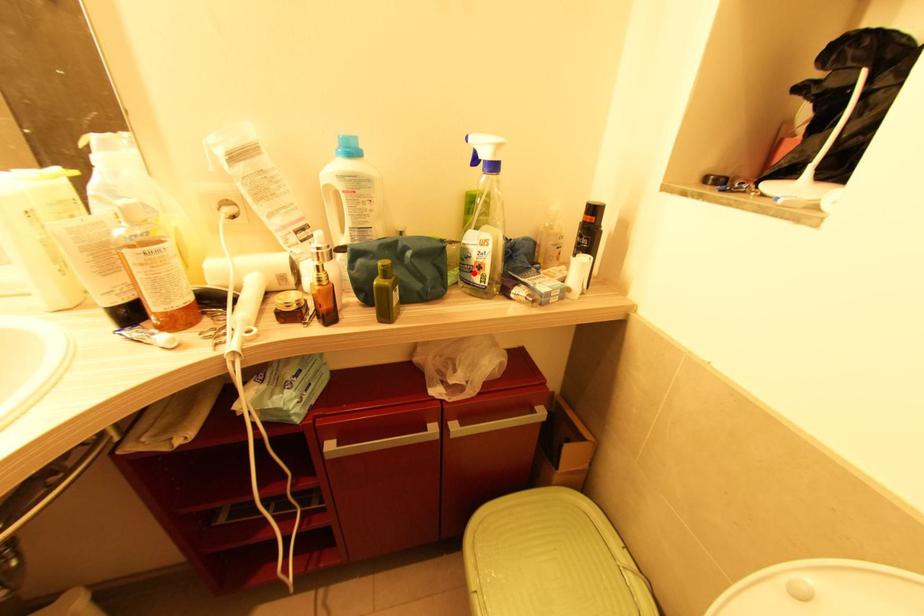
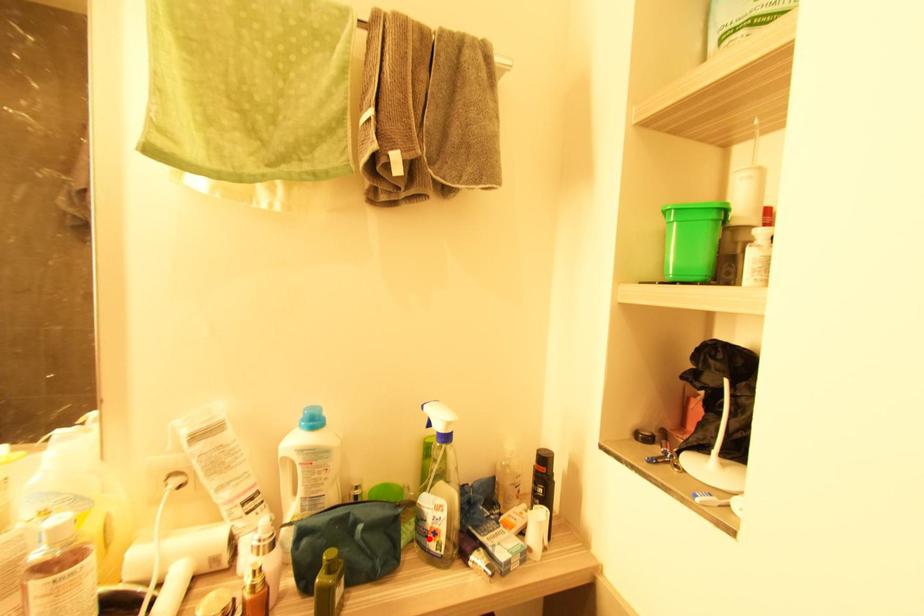
I am providing you with two images of the same scene from different viewpoints. A red point is marked on the first image and another point is marked on the second image. Are the points marked in image1 and image2 representing the same 3D position?

Yes